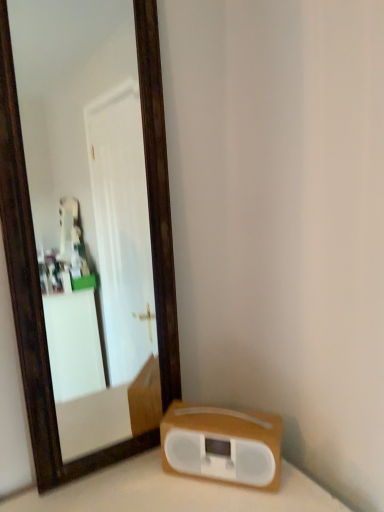
Image resolution: width=384 pixels, height=512 pixels. I want to click on free space in front of white plastic stereo at lower right, so click(x=224, y=495).